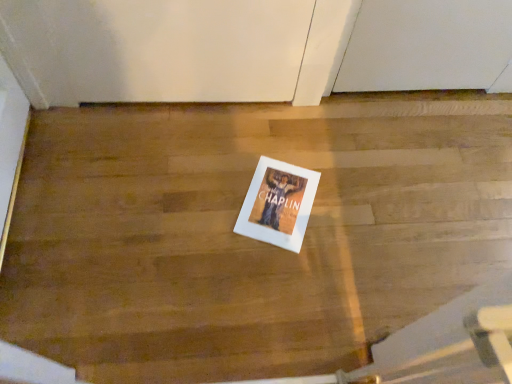
Locate an element on the screen. The image size is (512, 384). free spot in front of white paper at center is located at coordinates (267, 273).